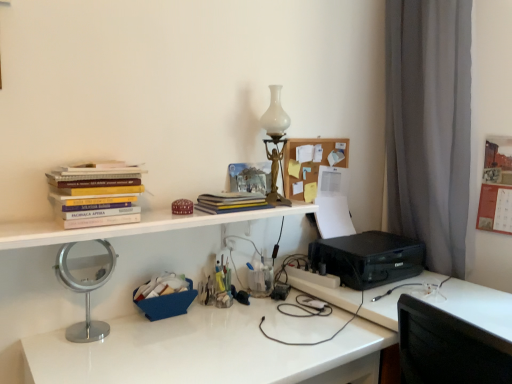
What is the approximate height of white glass table lamp at upper center?

white glass table lamp at upper center is 47.82 centimeters in height.

The height and width of the screenshot is (384, 512). Identify the location of white glossy desk at center. (215, 346).

Identify the location of hardcover books at upper left, marked as the 1th book in a front-to-back arrangement. click(x=96, y=194).

Where is `black plastic printer at lower right`? The image size is (512, 384). black plastic printer at lower right is located at coordinates (369, 258).

Where is `translucent plastic container at center, the second stationery when ordered from bottom to top`? The image size is (512, 384). translucent plastic container at center, the second stationery when ordered from bottom to top is located at coordinates (217, 286).

Which is more to the right, wooden corkboard at upper center or white glass table lamp at upper center?

From the viewer's perspective, wooden corkboard at upper center appears more on the right side.

Is wooden corkboard at upper center beside white glass table lamp at upper center?

wooden corkboard at upper center and white glass table lamp at upper center are not in contact.

In the scene shown: Can we say wooden corkboard at upper center lies outside white glass table lamp at upper center?

wooden corkboard at upper center lies outside white glass table lamp at upper center's area.

Is white glossy desk at center wider or thinner than translucent plastic container at center, acting as the 2th stationery starting from the top?

Considering their sizes, white glossy desk at center looks broader than translucent plastic container at center, acting as the 2th stationery starting from the top.

Is white glossy desk at center located outside translucent plastic container at center, acting as the 2th stationery starting from the top?

Indeed, white glossy desk at center is completely outside translucent plastic container at center, acting as the 2th stationery starting from the top.

From the image's perspective, count 2nd stationerys upward from the white glossy desk at center and point to it. Please provide its 2D coordinates.

[(217, 286)]

Considering the relative sizes of black plastic printer at lower right and wooden corkboard at upper center in the image provided, is black plastic printer at lower right wider than wooden corkboard at upper center?

Yes.

Based on the photo, is black plastic printer at lower right facing towards wooden corkboard at upper center?

No.

From the image's perspective, relative to wooden corkboard at upper center, is black plastic printer at lower right above or below?

From the image's perspective, black plastic printer at lower right appears below wooden corkboard at upper center.

Which of these two, white glossy desk at center or matte red box at upper center, marked as the 3th stationery in a bottom-to-top arrangement, stands taller?

Standing taller between the two is white glossy desk at center.

Relative to matte red box at upper center, marked as the 3th stationery in a bottom-to-top arrangement, is white glossy desk at center in front or behind?

Clearly, white glossy desk at center is in front of matte red box at upper center, marked as the 3th stationery in a bottom-to-top arrangement.

From a real-world perspective, is white glossy desk at center positioned under matte red box at upper center, the first stationery when ordered from top to bottom, based on gravity?

Yes.

Is point (38, 375) positioned after point (180, 214)?

No, it is in front of (180, 214).

From the image's perspective, which one is positioned lower, white glass table lamp at upper center or black plastic printer at lower right?

From the image's view, black plastic printer at lower right is below.

Is white glass table lamp at upper center turned away from black plastic printer at lower right?

white glass table lamp at upper center is not turned away from black plastic printer at lower right.

Where is `table lamp above the black plastic printer at lower right (from the image's perspective)`? This screenshot has height=384, width=512. table lamp above the black plastic printer at lower right (from the image's perspective) is located at coordinates (275, 141).

Which object is more forward, white glass table lamp at upper center or black plastic printer at lower right?

black plastic printer at lower right is in front.

Is there a large distance between white glass table lamp at upper center and silver metallic mirror at lower left?

white glass table lamp at upper center is actually quite close to silver metallic mirror at lower left.

Is white glass table lamp at upper center facing away from silver metallic mirror at lower left?

No, white glass table lamp at upper center is not facing away from silver metallic mirror at lower left.

From a real-world perspective, between white glass table lamp at upper center and silver metallic mirror at lower left, who is vertically higher?

From a 3D spatial view, white glass table lamp at upper center is above.

Can you confirm if blue fabric basket at center, arranged as the 1th stationery when ordered from the bottom, is wider than wooden corkboard at upper center?

Yes, blue fabric basket at center, arranged as the 1th stationery when ordered from the bottom, is wider than wooden corkboard at upper center.

Considering the sizes of objects blue fabric basket at center, the 3th stationery viewed from the top, and wooden corkboard at upper center in the image provided, who is taller, blue fabric basket at center, the 3th stationery viewed from the top, or wooden corkboard at upper center?

Standing taller between the two is wooden corkboard at upper center.

From the image's perspective, is blue fabric basket at center, arranged as the 1th stationery when ordered from the bottom, positioned above or below wooden corkboard at upper center?

Clearly, from the image's perspective, blue fabric basket at center, arranged as the 1th stationery when ordered from the bottom, is below wooden corkboard at upper center.

Could you tell me if blue fabric basket at center, the 3th stationery viewed from the top, is facing wooden corkboard at upper center?

No, blue fabric basket at center, the 3th stationery viewed from the top, is not facing towards wooden corkboard at upper center.

Locate an element on the screen. Image resolution: width=512 pixels, height=384 pixels. shelf that appears below the white glass table lamp at upper center (from the image's perspective) is located at coordinates (310, 162).

Image resolution: width=512 pixels, height=384 pixels. Identify the location of the 1st stationery counting from the left of the white glossy desk at center. (217, 286).

Considering their positions, is silver metallic mirror at lower left positioned further to matte red box at upper center, marked as the 3th stationery in a bottom-to-top arrangement, than translucent plastic container at center, the second stationery when ordered from bottom to top?

silver metallic mirror at lower left.

Which object lies nearer to the anchor point black plastic printer at lower right, wooden corkboard at upper center or white glossy desk at center?

white glossy desk at center lies closer to black plastic printer at lower right than the other object.

From the image, which object appears to be nearer to black plastic printer at lower right, blue fabric basket at center, arranged as the 1th stationery when ordered from the bottom, or wooden corkboard at upper center?

wooden corkboard at upper center is closer to black plastic printer at lower right.

Looking at this image, which object lies further to the anchor point yellow matte book at center, the second book viewed from the left, white glossy desk at center or silver metallic mirror at lower left?

white glossy desk at center lies further to yellow matte book at center, the second book viewed from the left, than the other object.

Based on their spatial positions, is translucent plastic container at center, the second stationery when ordered from bottom to top, or blue fabric basket at center, arranged as the 1th stationery when ordered from the bottom, further from matte red box at upper center, marked as the 3th stationery in a bottom-to-top arrangement?

translucent plastic container at center, the second stationery when ordered from bottom to top, is positioned further to the anchor matte red box at upper center, marked as the 3th stationery in a bottom-to-top arrangement.

Looking at the image, which one is located closer to blue fabric basket at center, the 3th stationery viewed from the top, white glass table lamp at upper center or translucent plastic container at center, the second stationery when ordered from bottom to top?

translucent plastic container at center, the second stationery when ordered from bottom to top, is closer to blue fabric basket at center, the 3th stationery viewed from the top.

When comparing their distances from yellow matte book at center, which appears as the 2th book when viewed from the front, does blue fabric basket at center, the 3th stationery viewed from the top, or silver metallic mirror at lower left seem closer?

blue fabric basket at center, the 3th stationery viewed from the top.

Which object lies nearer to the anchor point black plastic printer at lower right, wooden corkboard at upper center or hardcover books at upper left, which ranks as the second book in back-to-front order?

wooden corkboard at upper center is positioned closer to the anchor black plastic printer at lower right.

The width and height of the screenshot is (512, 384). In order to click on table lamp positioned between yellow matte book at center, the 1th book from the right, and wooden corkboard at upper center from near to far in this screenshot , I will do `click(275, 141)`.

Where is `table lamp located between matte red box at upper center, marked as the 3th stationery in a bottom-to-top arrangement, and wooden corkboard at upper center in the left-right direction`? The height and width of the screenshot is (384, 512). table lamp located between matte red box at upper center, marked as the 3th stationery in a bottom-to-top arrangement, and wooden corkboard at upper center in the left-right direction is located at coordinates (275, 141).

Where is `desk situated between silver metallic mirror at lower left and black plastic printer at lower right from left to right`? This screenshot has width=512, height=384. desk situated between silver metallic mirror at lower left and black plastic printer at lower right from left to right is located at coordinates (215, 346).

This screenshot has height=384, width=512. Identify the location of book between silver metallic mirror at lower left and yellow matte book at center, the 1th book from the right, from left to right. (96, 194).